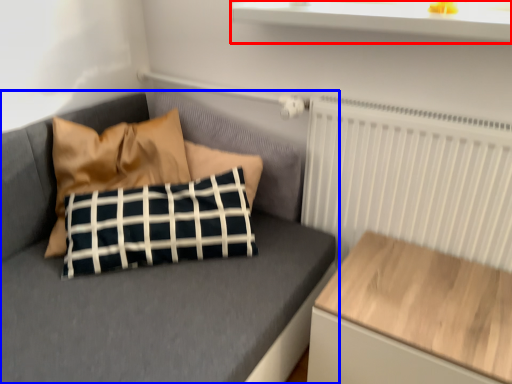
Question: Which object is further to the camera taking this photo, window sill (highlighted by a red box) or studio couch (highlighted by a blue box)?

Choices:
 (A) window sill
 (B) studio couch

Answer: (B)